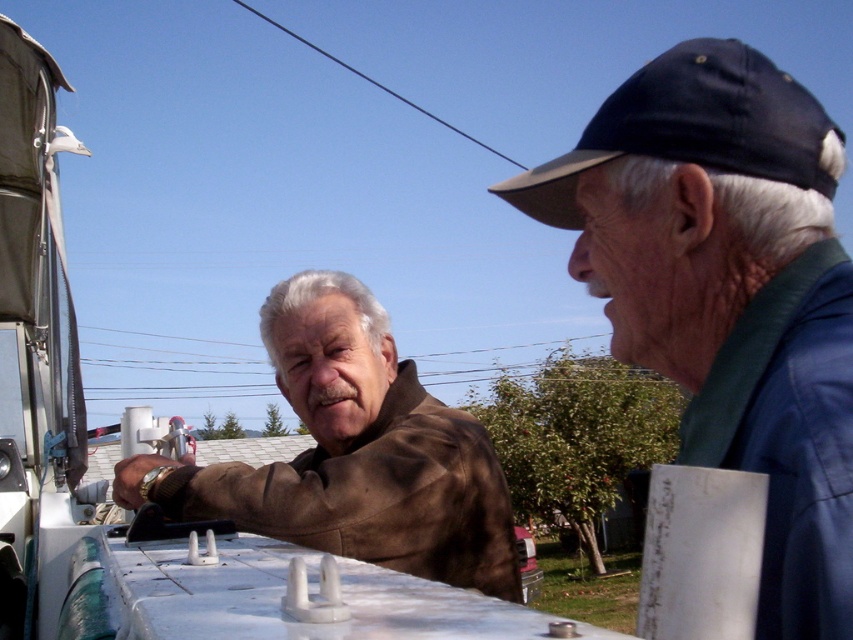
You are a photographer trying to capture a clear photo of both the blue fabric cap at upper right and the navy blue fabric baseball cap at upper right. Which cap should you focus on first if you want to ensure both are in focus, considering their positions?

The blue fabric cap at upper right is positioned on the left side of navy blue fabric baseball cap at upper right, so you should focus on the blue fabric cap at upper right first as it is closer to the left edge, ensuring both are within the frame.